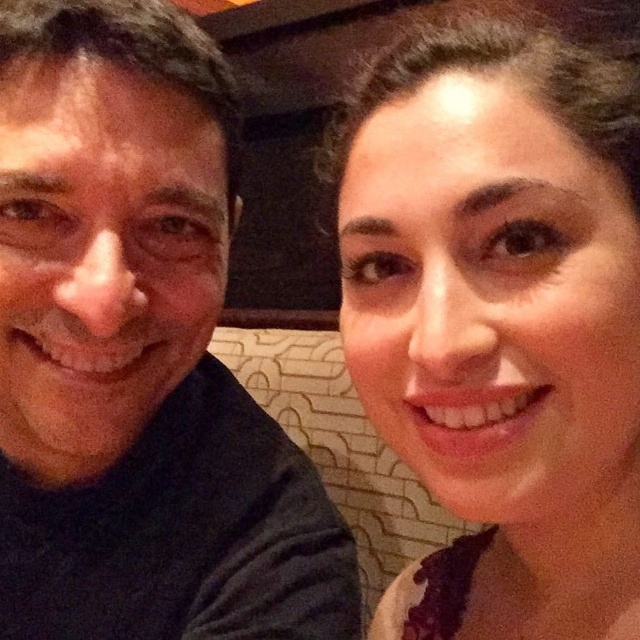
Does point (52, 330) lie behind point (552, 340)?

Yes, point (52, 330) is farther from viewer.

What do you see at coordinates (138, 353) in the screenshot?
I see `dark gray t-shirt at left` at bounding box center [138, 353].

Does point (61, 56) come in front of point (516, 260)?

No, it is not.

What are the coordinates of `dark gray t-shirt at left` in the screenshot? It's located at (138, 353).